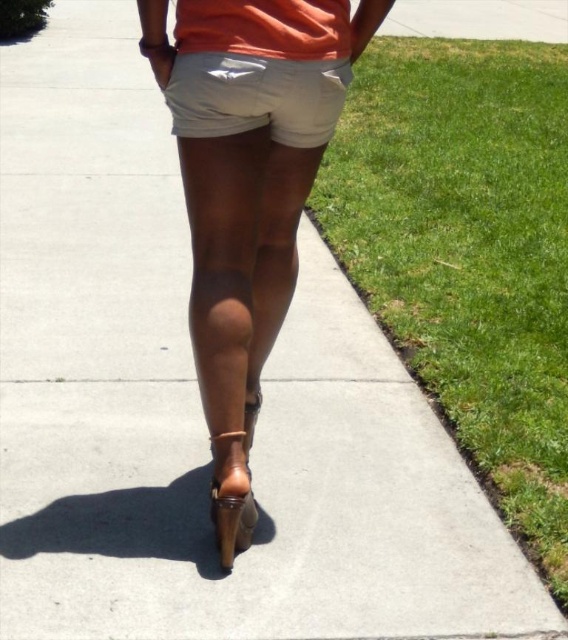
Question: Which point is closer to the camera?

Choices:
 (A) white cotton shorts at center
 (B) brown leather sandal at lower center

Answer: (A)

Question: From the image, what is the correct spatial relationship of white cotton shorts at center in relation to brown leather sandal at lower center?

Choices:
 (A) below
 (B) above

Answer: (B)

Question: Can you confirm if white cotton shorts at center is positioned to the right of brown leather sandal at lower center?

Choices:
 (A) no
 (B) yes

Answer: (B)

Question: Is the position of tan leather high heels at center more distant than that of white cotton shorts at center?

Choices:
 (A) yes
 (B) no

Answer: (A)

Question: Which point appears closest to the camera in this image?

Choices:
 (A) (311, 92)
 (B) (294, 124)

Answer: (A)

Question: Which object is the closest to the brown leather sandal at lower center?

Choices:
 (A) white cotton shorts at center
 (B) tan leather high heels at center

Answer: (B)